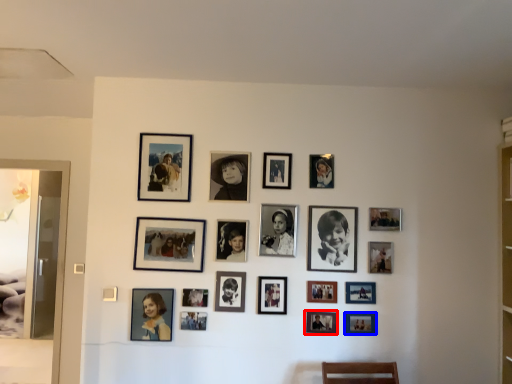
Question: Which point is further to the camera, picture frame (highlighted by a red box) or picture frame (highlighted by a blue box)?

Choices:
 (A) picture frame
 (B) picture frame

Answer: (B)